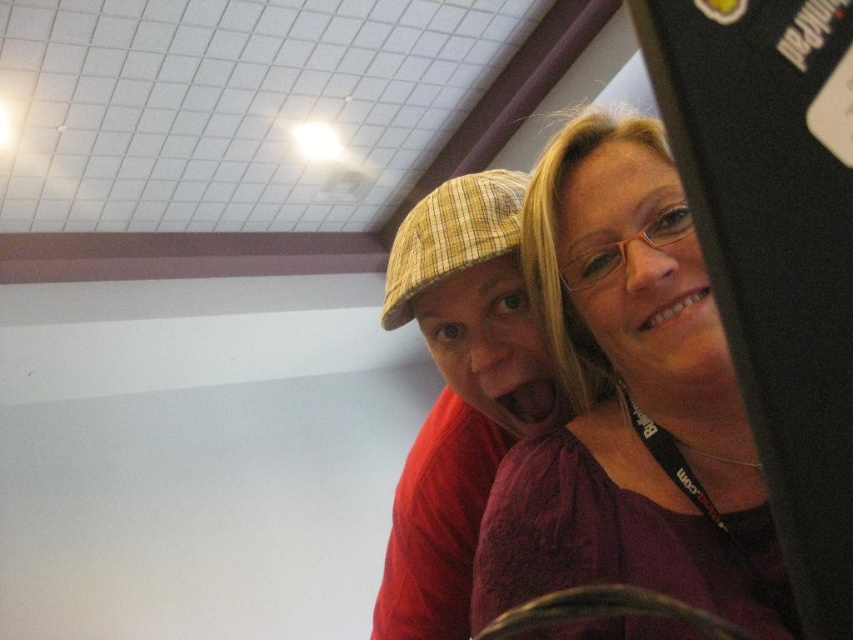
Question: Which of these objects is positioned closest to the black glossy monitor at upper right?

Choices:
 (A) plaid fabric cap at center
 (B) matte purple blouse at upper right

Answer: (B)

Question: Does matte purple blouse at upper right come in front of black glossy monitor at upper right?

Choices:
 (A) no
 (B) yes

Answer: (A)

Question: Which is nearer to the black glossy monitor at upper right?

Choices:
 (A) plaid fabric cap at center
 (B) matte purple blouse at upper right

Answer: (B)

Question: Is matte purple blouse at upper right wider than black glossy monitor at upper right?

Choices:
 (A) yes
 (B) no

Answer: (A)

Question: Does matte purple blouse at upper right have a smaller size compared to black glossy monitor at upper right?

Choices:
 (A) yes
 (B) no

Answer: (B)

Question: Based on their relative distances, which object is farther from the matte purple blouse at upper right?

Choices:
 (A) plaid fabric cap at center
 (B) black glossy monitor at upper right

Answer: (B)